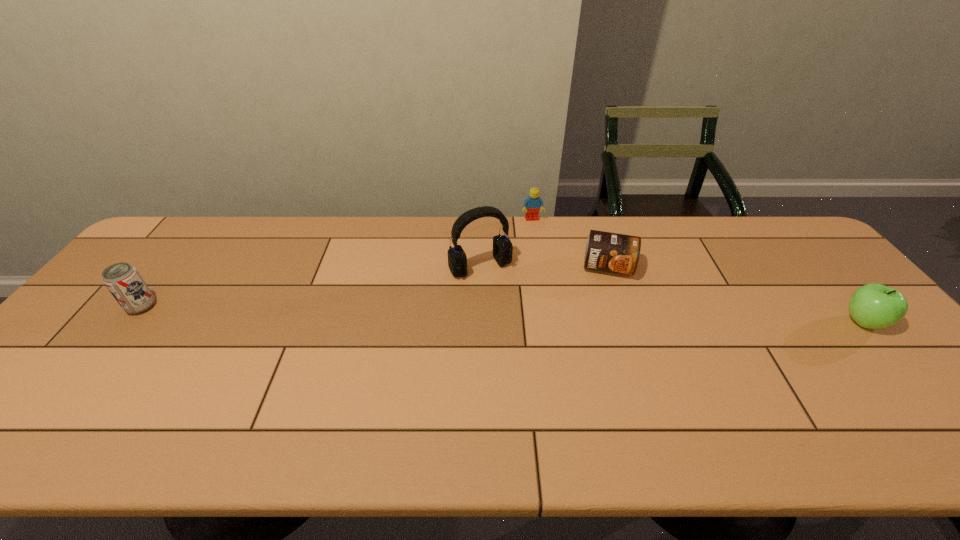
You are a GUI agent. You are given a task and a screenshot of the screen. Output one action in this format:
    pyautogui.click(x=<x>, y=<y>)
    Task: Click on the can present at the far edge
    Image resolution: width=960 pixels, height=540 pixels.
    Given the screenshot: What is the action you would take?
    pyautogui.click(x=606, y=251)

Locate an element on the screen. The height and width of the screenshot is (540, 960). object that is at the left edge is located at coordinates (124, 282).

Locate an element on the screen. The image size is (960, 540). object located in the right edge section of the desktop is located at coordinates (874, 306).

Where is `free region at the far edge of the desktop`? Image resolution: width=960 pixels, height=540 pixels. free region at the far edge of the desktop is located at coordinates (242, 249).

Find the location of a particular element. The height and width of the screenshot is (540, 960). vacant region at the near edge is located at coordinates (564, 393).

In the image, there is a desktop. Where is `vacant region at the right edge`? Image resolution: width=960 pixels, height=540 pixels. vacant region at the right edge is located at coordinates (843, 323).

I want to click on blank space at the far left corner, so click(177, 237).

Find the location of a particular element. This screenshot has width=960, height=540. free location at the near left corner of the desktop is located at coordinates (37, 394).

This screenshot has width=960, height=540. In the image, there is a desktop. In order to click on vacant region at the far right corner in this screenshot , I will do `click(792, 260)`.

Where is `free spot between the leftmost object and the Lego`? The height and width of the screenshot is (540, 960). free spot between the leftmost object and the Lego is located at coordinates (337, 263).